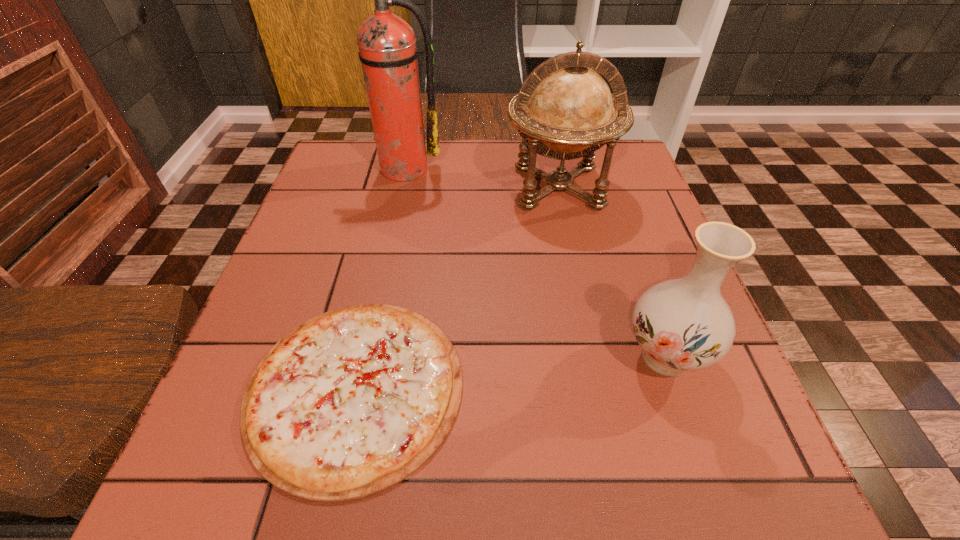
The height and width of the screenshot is (540, 960). What are the coordinates of `object that is at the near edge` in the screenshot? It's located at (351, 402).

In order to click on fire extinguisher at the left edge in this screenshot , I will do `click(387, 48)`.

Find the location of a particular element. The image size is (960, 540). pizza that is at the left edge is located at coordinates (351, 402).

Locate an element on the screen. globe at the right edge is located at coordinates (564, 110).

I want to click on vase located at the right edge, so [684, 324].

You are a GUI agent. You are given a task and a screenshot of the screen. Output one action in this format:
    pyautogui.click(x=<x>, y=<y>)
    Task: Click on the object positioned at the far left corner
    Image resolution: width=960 pixels, height=540 pixels.
    Given the screenshot: What is the action you would take?
    pyautogui.click(x=387, y=48)

The image size is (960, 540). I want to click on object that is positioned at the near left corner, so click(x=351, y=402).

The width and height of the screenshot is (960, 540). In order to click on object present at the far right corner in this screenshot , I will do `click(564, 110)`.

Where is `vacant space at the far edge`? vacant space at the far edge is located at coordinates (419, 184).

In the image, there is a desktop. Where is `vacant space at the left edge`? The width and height of the screenshot is (960, 540). vacant space at the left edge is located at coordinates (372, 204).